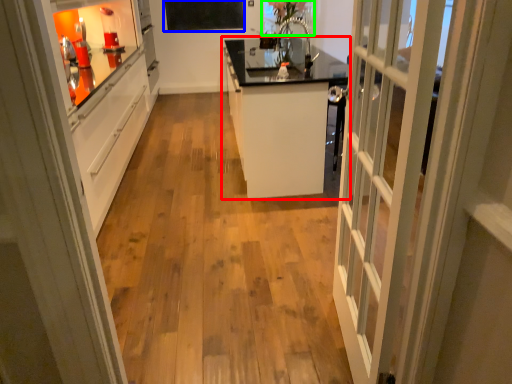
Question: Estimate the real-world distances between objects in this image. Which object is closer to cabinetry (highlighted by a red box), bulletin board (highlighted by a blue box) or window screen (highlighted by a green box)?

Choices:
 (A) bulletin board
 (B) window screen

Answer: (B)